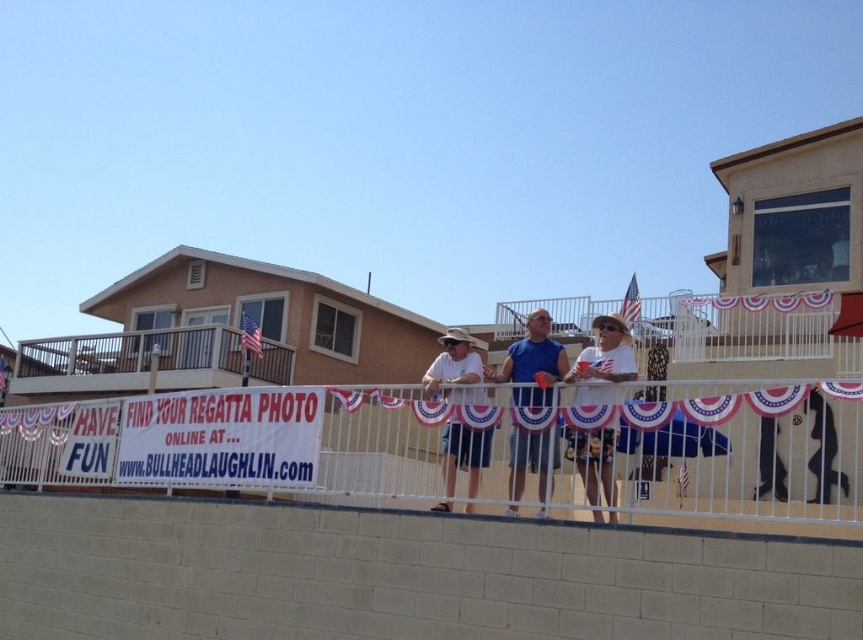
You are standing at point (452, 426) and want to move to point (29, 358). Given that the path between them is clear, will you need to walk forward or backward to reach your destination?

Since point (29, 358) is behind point (452, 426), you will need to walk backward to reach it from your current position at point (452, 426).

You are a photographer trying to capture a clear shot of the matte white hat at center and the white painted wood at upper left. However, you notice an obstruction. Which object is blocking the view of the other?

The white painted wood at upper left is blocking the view of the matte white hat at center because the matte white hat at center is behind the white painted wood at upper left.

You are at the event and want to take a photo with your surfboard. Where should you position the black matte surfboard at center so it is visible in the background of your photo? Use the white painted wood at upper left as a reference point.

Position the black matte surfboard at center behind the white painted wood at upper left. Since the white painted wood at upper left is above the black matte surfboard at center, placing the surfboard behind the wood will ensure it appears in the background of your photo.